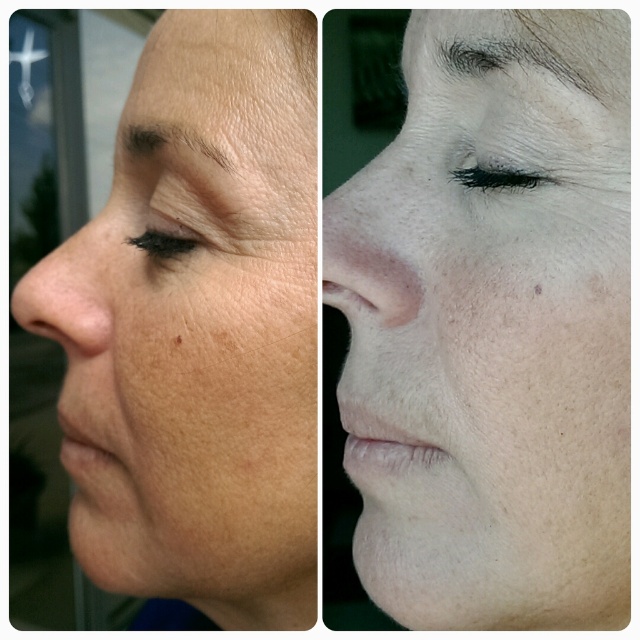
Question: Does dark brown hair at upper center have a lesser width compared to gray matte eyebrow at upper center?

Choices:
 (A) no
 (B) yes

Answer: (A)

Question: Can you confirm if smooth skin face at left is positioned above dark brown hair at upper center?

Choices:
 (A) no
 (B) yes

Answer: (A)

Question: Which point is closer to the camera taking this photo?

Choices:
 (A) (470, 54)
 (B) (573, 60)
 (C) (304, 72)
 (D) (579, 51)

Answer: (D)

Question: Which object is positioned closest to the smooth skin forehead at upper center?

Choices:
 (A) gray matte eyebrow at upper center
 (B) smooth skin face at left

Answer: (A)

Question: Is smooth skin at center below black matte eyelashes at upper center?

Choices:
 (A) yes
 (B) no

Answer: (A)

Question: Estimate the real-world distances between objects in this image. Which object is closer to the dark brown hair at upper center?

Choices:
 (A) dry skin at upper left
 (B) smooth skin forehead at upper center

Answer: (B)